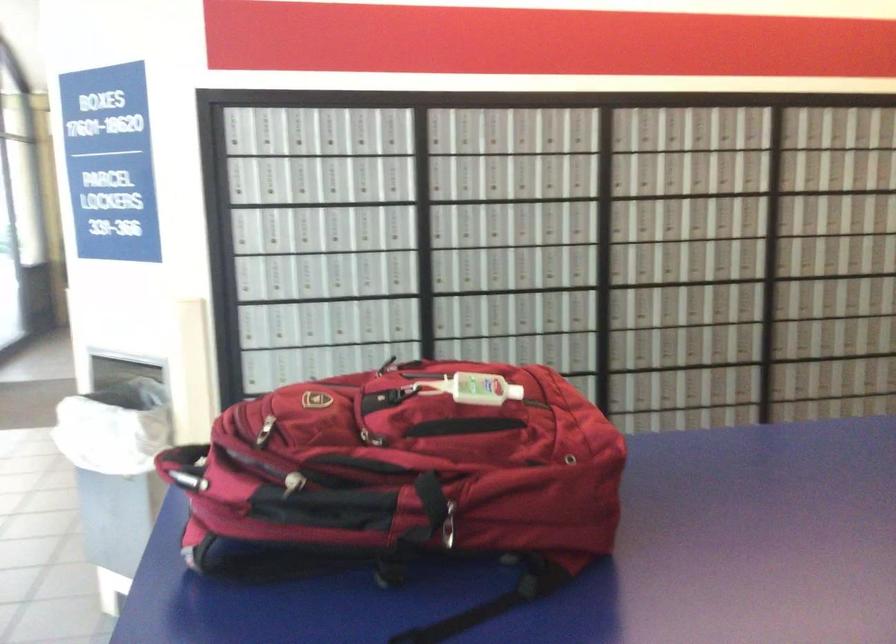
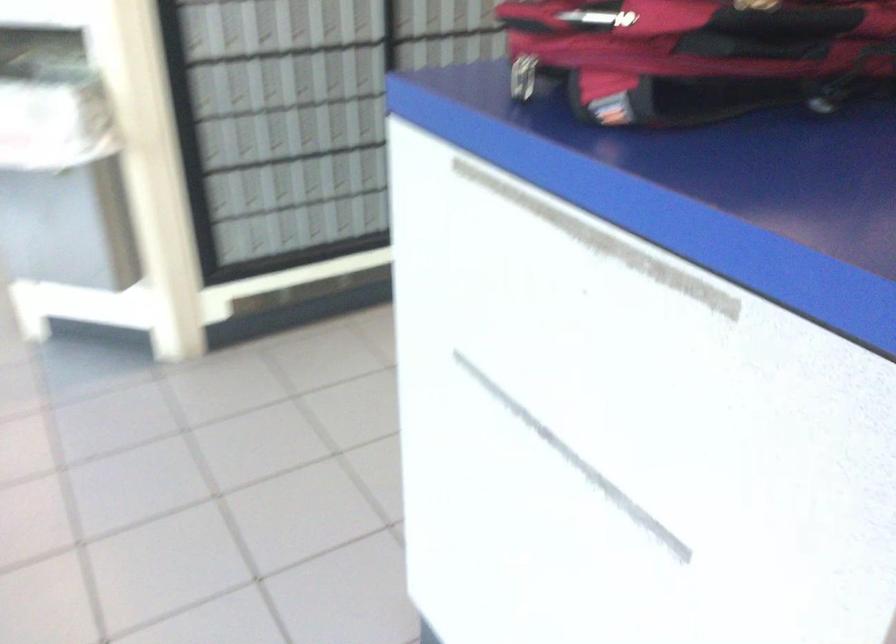
Question: The images are taken continuously from a first-person perspective. In which direction are you moving?

Choices:
 (A) Left
 (B) Right
 (C) Forward
 (D) Backward

Answer: (A)